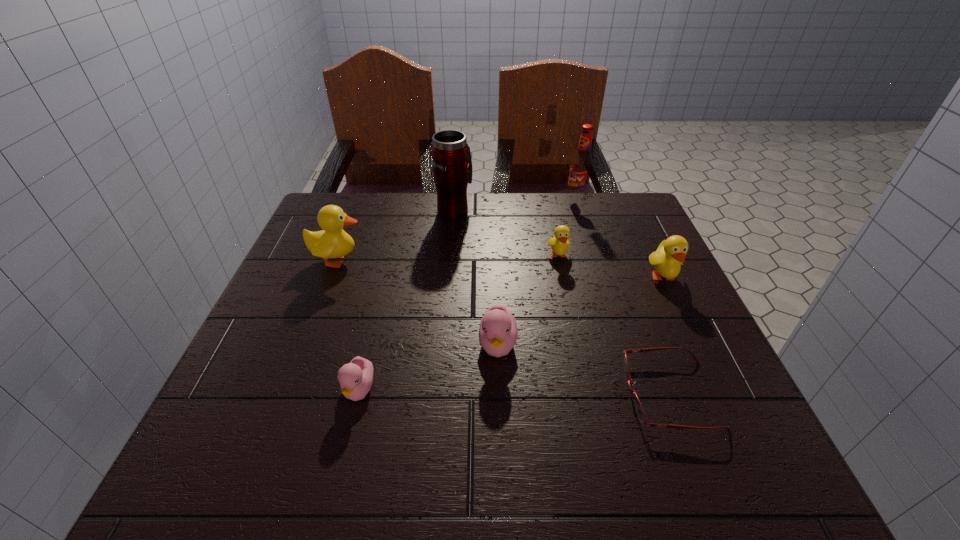
You are a GUI agent. You are given a task and a screenshot of the screen. Output one action in this format:
    pyautogui.click(x=<x>, y=<y>)
    Task: Click on the blank area located 0.070m on the front-facing side of the left pink duckling
    
    Given the screenshot: What is the action you would take?
    pyautogui.click(x=345, y=451)

Locate an element on the screen. The width and height of the screenshot is (960, 540). vacant space located on the lenses of the spectacles is located at coordinates (440, 394).

At what (x,y) coordinates should I click in order to perform the action: click on blank space located 0.370m on the lenses of the spectacles. Please return your answer as a coordinate pair (x, y). Image resolution: width=960 pixels, height=540 pixels. Looking at the image, I should click on coord(418,394).

Image resolution: width=960 pixels, height=540 pixels. Find the location of `vacant space situated 0.090m on the lenses of the spectacles`. vacant space situated 0.090m on the lenses of the spectacles is located at coordinates (575, 394).

This screenshot has height=540, width=960. I want to click on thermos bottle present at the far edge, so click(452, 165).

The width and height of the screenshot is (960, 540). In order to click on root beer that is at the far edge in this screenshot , I will do `click(581, 168)`.

You are a GUI agent. You are given a task and a screenshot of the screen. Output one action in this format:
    pyautogui.click(x=<x>, y=<y>)
    Task: Click on the object at the near edge
    The width and height of the screenshot is (960, 540).
    Given the screenshot: What is the action you would take?
    pyautogui.click(x=639, y=410)

At what (x,y) coordinates should I click in order to perform the action: click on object positioned at the left edge. Please return your answer as a coordinate pair (x, y). This screenshot has height=540, width=960. Looking at the image, I should click on (332, 242).

Find the location of a particular element. root beer at the right edge is located at coordinates (581, 168).

Where is `duckling present at the right edge`? The width and height of the screenshot is (960, 540). duckling present at the right edge is located at coordinates (667, 260).